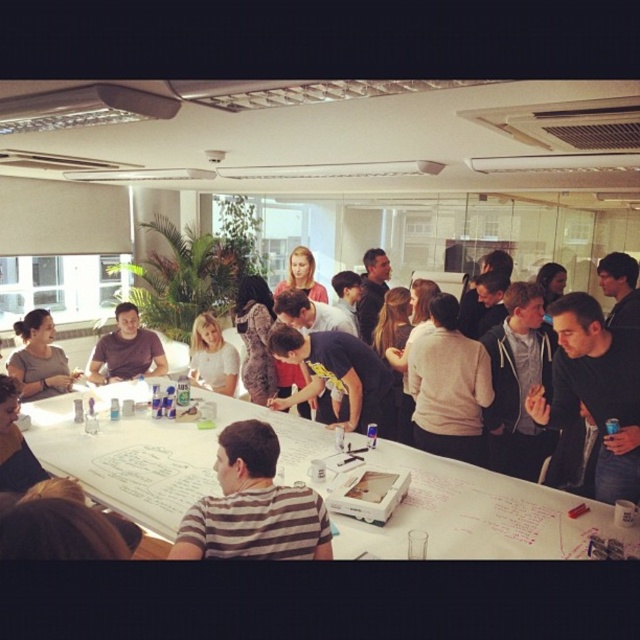
Question: Which point appears farthest from the camera in this image?

Choices:
 (A) (230, 384)
 (B) (248, 502)
 (C) (68, 378)
 (D) (148, 348)

Answer: (A)

Question: From the image, what is the correct spatial relationship of striped cotton shirt at center in relation to matte brown shirt at center?

Choices:
 (A) left
 (B) right

Answer: (B)

Question: Which of the following is the closest to the observer?

Choices:
 (A) matte black shirt at center
 (B) matte brown shirt at center
 (C) light brown hair at center
 (D) white paperboard at center

Answer: (D)

Question: Where is white paperboard at center located in relation to matte black shirt at center in the image?

Choices:
 (A) left
 (B) right

Answer: (B)

Question: Is white paperboard at center above matte black shirt at center?

Choices:
 (A) yes
 (B) no

Answer: (B)

Question: Considering the real-world distances, which object is farthest from the white paperboard at center?

Choices:
 (A) light brown hair at center
 (B) striped cotton shirt at center
 (C) matte black shirt at center
 (D) matte brown shirt at center

Answer: (A)